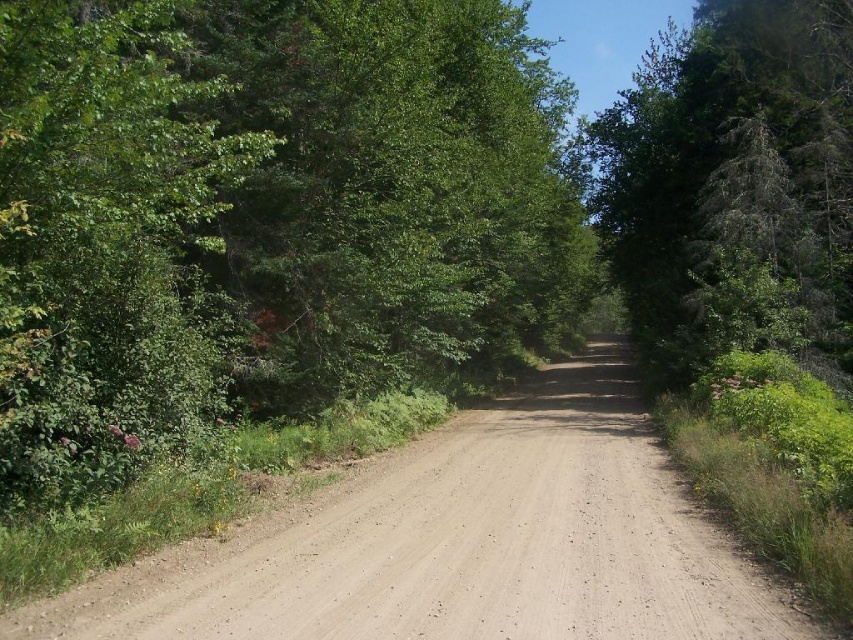
Looking at this image, between dirt track at center and green textured tree at center, which one has more height?

With more height is green textured tree at center.

Is dirt track at center to the right of green textured tree at center from the viewer's perspective?

No, dirt track at center is not to the right of green textured tree at center.

Measure the distance between point (564, 442) and camera.

Point (564, 442) and camera are 15.05 meters apart from each other.

The height and width of the screenshot is (640, 853). In order to click on dirt track at center in this screenshot , I will do `click(462, 544)`.

Who is shorter, green leafy tree at left or dirt track at center?

With less height is dirt track at center.

Who is lower down, green leafy tree at left or dirt track at center?

dirt track at center is below.

Measure the distance between green leafy tree at left and camera.

The distance of green leafy tree at left from camera is 19.80 feet.

You are a GUI agent. You are given a task and a screenshot of the screen. Output one action in this format:
    pyautogui.click(x=<x>, y=<y>)
    Task: Click on the green leafy tree at left
    
    Given the screenshot: What is the action you would take?
    pyautogui.click(x=267, y=218)

Is green leafy tree at left to the left of green textured tree at center from the viewer's perspective?

Correct, you'll find green leafy tree at left to the left of green textured tree at center.

Between point (556, 292) and point (679, 147), which one is positioned behind?

The point (556, 292) is more distant.

Find the location of a particular element. green leafy tree at left is located at coordinates (267, 218).